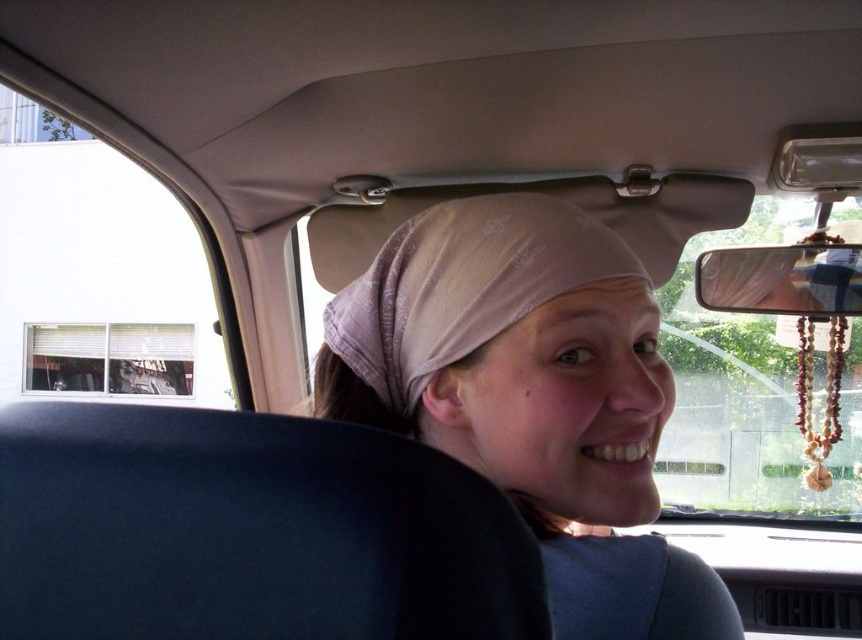
You are sitting in the passenger seat of the car and want to hand the driver a small item. The item is currently in your hand. Considering the distance between you and the pink fabric headscarf at center, can you reach the driver without stretching your arm too much?

The distance between you and the pink fabric headscarf at center is 13.41 inches. Since this distance is relatively short, you can likely reach the driver without needing to stretch your arm excessively.

Looking at this image, you are a passenger in the car and want to reach the dark blue fabric at center to adjust it. Your hand can extend 30 centimeters. Can you reach it?

The dark blue fabric at center is 28.85 centimeters from the camera, so yes, your hand can reach it since it extends 30 centimeters.

You are a passenger in the car and want to adjust the sun visor. The driver is wearing two headscarves. Which headscarf is closer to the sun visor, the pink fabric headscarf at center or the pale pink sheer fabric headscarf at center?

The pale pink sheer fabric headscarf at center is closer to the sun visor because it is positioned above the pink fabric headscarf at center.